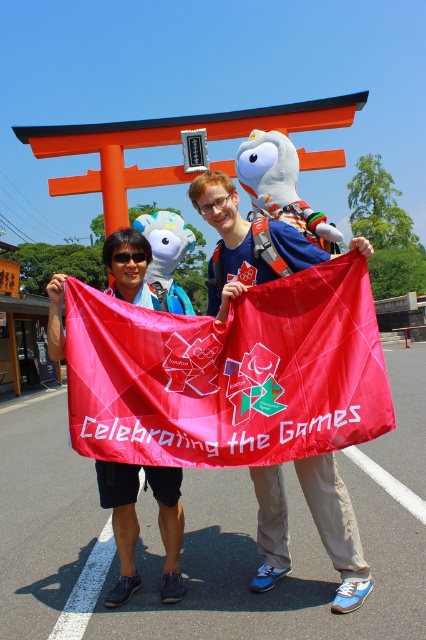
Does matte fabric flag at center have a smaller size compared to white plush toy at center?

Yes, matte fabric flag at center is smaller than white plush toy at center.

Can you confirm if matte fabric flag at center is taller than white plush toy at center?

In fact, matte fabric flag at center may be shorter than white plush toy at center.

Locate an element on the screen. This screenshot has width=426, height=640. matte fabric flag at center is located at coordinates (229, 372).

Who is taller, matte fabric flag at center or matte blue shirt at center?

With more height is matte fabric flag at center.

Is matte fabric flag at center thinner than matte blue shirt at center?

No, matte fabric flag at center is not thinner than matte blue shirt at center.

Locate an element on the screen. matte fabric flag at center is located at coordinates (229, 372).

How distant is matte blue shirt at center from white plush toy at center?

They are 2.31 meters apart.

Between point (307, 266) and point (250, 144), which one is positioned behind?

Point (250, 144)

This screenshot has height=640, width=426. Find the location of `matte blue shirt at center`. matte blue shirt at center is located at coordinates (244, 243).